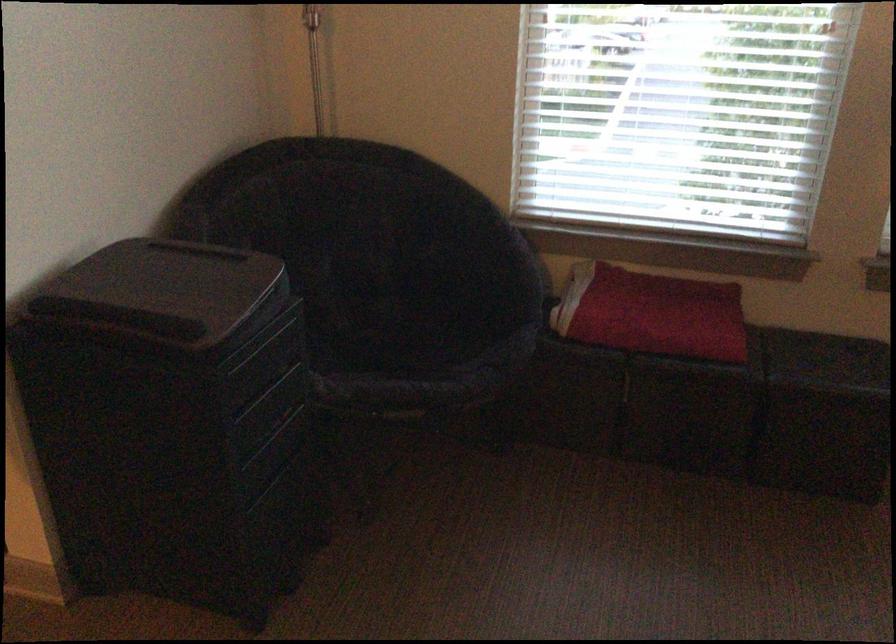
Locate an element on the screen. The image size is (896, 644). chair sitting surface is located at coordinates coord(393,339).